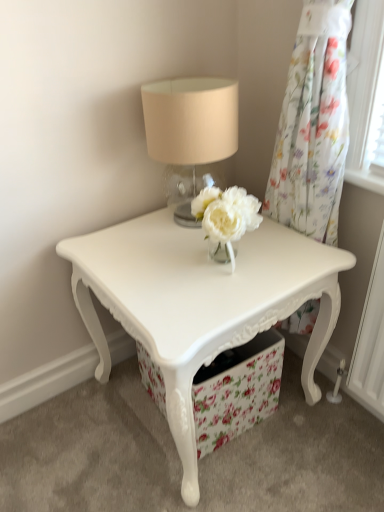
Question: Is floral sheer curtain at upper right placed right next to white glossy table at center?

Choices:
 (A) no
 (B) yes

Answer: (A)

Question: From a real-world perspective, is floral sheer curtain at upper right located beneath white glossy table at center?

Choices:
 (A) yes
 (B) no

Answer: (B)

Question: Is floral sheer curtain at upper right located outside white glossy table at center?

Choices:
 (A) no
 (B) yes

Answer: (B)

Question: From the image's perspective, would you say floral sheer curtain at upper right is shown under white glossy table at center?

Choices:
 (A) yes
 (B) no

Answer: (B)

Question: Can you confirm if floral sheer curtain at upper right is positioned to the right of white glossy table at center?

Choices:
 (A) no
 (B) yes

Answer: (B)

Question: Considering the relative sizes of floral sheer curtain at upper right and white glossy table at center in the image provided, is floral sheer curtain at upper right thinner than white glossy table at center?

Choices:
 (A) no
 (B) yes

Answer: (B)

Question: Considering the relative sizes of matte glass table lamp at upper center and floral sheer curtain at upper right in the image provided, is matte glass table lamp at upper center smaller than floral sheer curtain at upper right?

Choices:
 (A) yes
 (B) no

Answer: (A)

Question: From a real-world perspective, is matte glass table lamp at upper center located higher than floral sheer curtain at upper right?

Choices:
 (A) no
 (B) yes

Answer: (B)

Question: Does matte glass table lamp at upper center have a lesser height compared to floral sheer curtain at upper right?

Choices:
 (A) yes
 (B) no

Answer: (A)

Question: Is matte glass table lamp at upper center turned away from floral sheer curtain at upper right?

Choices:
 (A) yes
 (B) no

Answer: (B)

Question: Does matte glass table lamp at upper center lie behind floral sheer curtain at upper right?

Choices:
 (A) yes
 (B) no

Answer: (A)

Question: From the image's perspective, would you say matte glass table lamp at upper center is shown under floral sheer curtain at upper right?

Choices:
 (A) yes
 (B) no

Answer: (B)

Question: Does floral sheer curtain at upper right come behind matte glass table lamp at upper center?

Choices:
 (A) no
 (B) yes

Answer: (A)